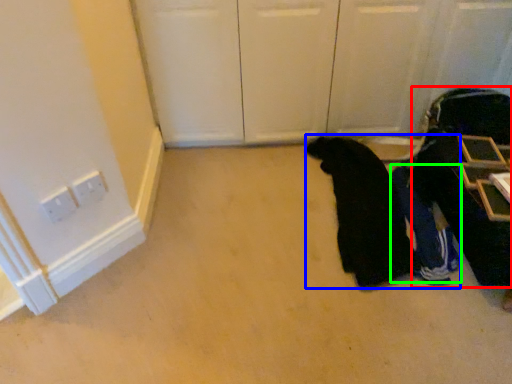
Question: Considering the real-world distances, which object is farthest from luggage (highlighted by a red box)? person (highlighted by a blue box) or person (highlighted by a green box)?

Choices:
 (A) person
 (B) person

Answer: (A)